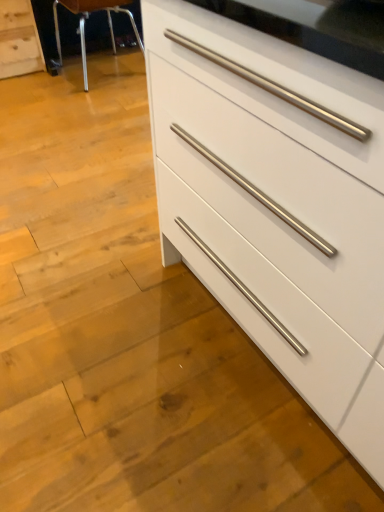
What do you see at coordinates (19, 40) in the screenshot? Image resolution: width=384 pixels, height=512 pixels. I see `white matte chest of drawers at lower left, arranged as the 1th chest of drawers when viewed from the left` at bounding box center [19, 40].

The height and width of the screenshot is (512, 384). What do you see at coordinates (278, 193) in the screenshot? I see `white glossy chest of drawers at center, which is the 2th chest of drawers from top to bottom` at bounding box center [278, 193].

Locate an element on the screen. This screenshot has height=512, width=384. white matte chest of drawers at lower left, which ranks as the second chest of drawers in bottom-to-top order is located at coordinates (19, 40).

Considering the relative sizes of white glossy chest of drawers at center, the first chest of drawers in the right-to-left sequence, and metallic silver bar stool at upper left in the image provided, is white glossy chest of drawers at center, the first chest of drawers in the right-to-left sequence, wider than metallic silver bar stool at upper left?

Yes.

From a real-world perspective, is white glossy chest of drawers at center, which is the 2th chest of drawers from top to bottom, under metallic silver bar stool at upper left?

No, from a real-world perspective, white glossy chest of drawers at center, which is the 2th chest of drawers from top to bottom, is not under metallic silver bar stool at upper left.

How far apart are white glossy chest of drawers at center, the 2th chest of drawers positioned from the left, and metallic silver bar stool at upper left?

A distance of 6.68 feet exists between white glossy chest of drawers at center, the 2th chest of drawers positioned from the left, and metallic silver bar stool at upper left.

Is white glossy chest of drawers at center, the 2th chest of drawers positioned from the left, not inside metallic silver bar stool at upper left?

Yes, white glossy chest of drawers at center, the 2th chest of drawers positioned from the left, is located beyond the bounds of metallic silver bar stool at upper left.

In the scene shown: Considering the relative positions of white glossy chest of drawers at center, which is the 2th chest of drawers from top to bottom, and white matte chest of drawers at lower left, which ranks as the second chest of drawers in bottom-to-top order, in the image provided, is white glossy chest of drawers at center, which is the 2th chest of drawers from top to bottom, to the left of white matte chest of drawers at lower left, which ranks as the second chest of drawers in bottom-to-top order, from the viewer's perspective?

Incorrect, white glossy chest of drawers at center, which is the 2th chest of drawers from top to bottom, is not on the left side of white matte chest of drawers at lower left, which ranks as the second chest of drawers in bottom-to-top order.

Is white glossy chest of drawers at center, which is the 2th chest of drawers from top to bottom, positioned before white matte chest of drawers at lower left, the first chest of drawers from the top?

Yes, white glossy chest of drawers at center, which is the 2th chest of drawers from top to bottom, is closer to the viewer.

Is white glossy chest of drawers at center, which is the 2th chest of drawers from top to bottom, bigger than white matte chest of drawers at lower left, which is the second chest of drawers in right-to-left order?

Indeed, white glossy chest of drawers at center, which is the 2th chest of drawers from top to bottom, has a larger size compared to white matte chest of drawers at lower left, which is the second chest of drawers in right-to-left order.

What's the angular difference between white glossy chest of drawers at center, the first chest of drawers from the bottom, and white matte chest of drawers at lower left, the first chest of drawers from the top,'s facing directions?

90 degrees separate the facing orientations of white glossy chest of drawers at center, the first chest of drawers from the bottom, and white matte chest of drawers at lower left, the first chest of drawers from the top.

From a real-world perspective, which is physically below, metallic silver bar stool at upper left or white matte chest of drawers at lower left, which is the second chest of drawers in right-to-left order?

In real-world perspective, white matte chest of drawers at lower left, which is the second chest of drawers in right-to-left order, is lower.

Who is taller, metallic silver bar stool at upper left or white matte chest of drawers at lower left, which ranks as the second chest of drawers in bottom-to-top order?

Standing taller between the two is metallic silver bar stool at upper left.

Is metallic silver bar stool at upper left thinner than white matte chest of drawers at lower left, the 2th chest of drawers viewed from the front?

In fact, metallic silver bar stool at upper left might be wider than white matte chest of drawers at lower left, the 2th chest of drawers viewed from the front.

Considering the relative positions of metallic silver bar stool at upper left and white matte chest of drawers at lower left, which ranks as the second chest of drawers in bottom-to-top order, in the image provided, is metallic silver bar stool at upper left to the right of white matte chest of drawers at lower left, which ranks as the second chest of drawers in bottom-to-top order, from the viewer's perspective?

Yes.

Which object is positioned more to the left, metallic silver bar stool at upper left or white glossy chest of drawers at center, the first chest of drawers in the right-to-left sequence?

From the viewer's perspective, metallic silver bar stool at upper left appears more on the left side.

From the image's perspective, is metallic silver bar stool at upper left under white glossy chest of drawers at center, the 2th chest of drawers positioned from the left?

No, from the image's perspective, metallic silver bar stool at upper left is not below white glossy chest of drawers at center, the 2th chest of drawers positioned from the left.

Is metallic silver bar stool at upper left far away from white glossy chest of drawers at center, the 1th chest of drawers from the front?

metallic silver bar stool at upper left is positioned a significant distance from white glossy chest of drawers at center, the 1th chest of drawers from the front.

From a real-world perspective, which is physically below, metallic silver bar stool at upper left or white glossy chest of drawers at center, the first chest of drawers in the right-to-left sequence?

metallic silver bar stool at upper left is physically lower.

From the picture: Is white matte chest of drawers at lower left, arranged as the 1th chest of drawers when viewed from the left, smaller than white glossy chest of drawers at center, the 1th chest of drawers from the front?

Correct, white matte chest of drawers at lower left, arranged as the 1th chest of drawers when viewed from the left, occupies less space than white glossy chest of drawers at center, the 1th chest of drawers from the front.

Based on their positions, is white matte chest of drawers at lower left, the 2th chest of drawers viewed from the front, located to the left or right of white glossy chest of drawers at center, the 1th chest of drawers from the front?

Clearly, white matte chest of drawers at lower left, the 2th chest of drawers viewed from the front, is on the left of white glossy chest of drawers at center, the 1th chest of drawers from the front, in the image.

Is white matte chest of drawers at lower left, the 2th chest of drawers viewed from the front, not near white glossy chest of drawers at center, the first chest of drawers from the bottom?

white matte chest of drawers at lower left, the 2th chest of drawers viewed from the front, is far away from white glossy chest of drawers at center, the first chest of drawers from the bottom.

Does point (4, 28) come closer to viewer compared to point (242, 209)?

No, it is behind (242, 209).

Measure the distance between white matte chest of drawers at lower left, the first chest of drawers from the top, and metallic silver bar stool at upper left.

white matte chest of drawers at lower left, the first chest of drawers from the top, and metallic silver bar stool at upper left are 10.74 inches apart.

Is white matte chest of drawers at lower left, which is the second chest of drawers in right-to-left order, directly adjacent to metallic silver bar stool at upper left?

No, white matte chest of drawers at lower left, which is the second chest of drawers in right-to-left order, is not making contact with metallic silver bar stool at upper left.

Which of these two, white matte chest of drawers at lower left, which is the second chest of drawers in right-to-left order, or metallic silver bar stool at upper left, is thinner?

white matte chest of drawers at lower left, which is the second chest of drawers in right-to-left order.

Is metallic silver bar stool at upper left at the back of white matte chest of drawers at lower left, the 2th chest of drawers viewed from the front?

No, white matte chest of drawers at lower left, the 2th chest of drawers viewed from the front,'s orientation is not away from metallic silver bar stool at upper left.

Locate an element on the screen. The width and height of the screenshot is (384, 512). the chest of drawers in front of the metallic silver bar stool at upper left is located at coordinates (278, 193).

Where is `the chest of drawers below the white matte chest of drawers at lower left, which ranks as the second chest of drawers in bottom-to-top order (from the image's perspective)`? This screenshot has width=384, height=512. the chest of drawers below the white matte chest of drawers at lower left, which ranks as the second chest of drawers in bottom-to-top order (from the image's perspective) is located at coordinates (278, 193).

Looking at the image, which one is located further to metallic silver bar stool at upper left, white matte chest of drawers at lower left, which is the second chest of drawers in right-to-left order, or white glossy chest of drawers at center, the 2th chest of drawers positioned from the left?

white glossy chest of drawers at center, the 2th chest of drawers positioned from the left, is positioned further to the anchor metallic silver bar stool at upper left.

Looking at this image, from the image, which object appears to be farther from white glossy chest of drawers at center, which is the 2th chest of drawers from top to bottom, metallic silver bar stool at upper left or white matte chest of drawers at lower left, the 2th chest of drawers viewed from the front?

Based on the image, white matte chest of drawers at lower left, the 2th chest of drawers viewed from the front, appears to be further to white glossy chest of drawers at center, which is the 2th chest of drawers from top to bottom.

When comparing their distances from white glossy chest of drawers at center, the first chest of drawers in the right-to-left sequence, does white matte chest of drawers at lower left, which is the second chest of drawers in right-to-left order, or metallic silver bar stool at upper left seem closer?

metallic silver bar stool at upper left lies closer to white glossy chest of drawers at center, the first chest of drawers in the right-to-left sequence, than the other object.

Estimate the real-world distances between objects in this image. Which object is further from metallic silver bar stool at upper left, white glossy chest of drawers at center, which is the 2th chest of drawers from top to bottom, or white matte chest of drawers at lower left, the first chest of drawers from the top?

white glossy chest of drawers at center, which is the 2th chest of drawers from top to bottom, is further to metallic silver bar stool at upper left.

Estimate the real-world distances between objects in this image. Which object is further from white matte chest of drawers at lower left, the first chest of drawers from the top, metallic silver bar stool at upper left or white glossy chest of drawers at center, the first chest of drawers in the right-to-left sequence?

white glossy chest of drawers at center, the first chest of drawers in the right-to-left sequence, is positioned further to the anchor white matte chest of drawers at lower left, the first chest of drawers from the top.

Based on their spatial positions, is white glossy chest of drawers at center, the 1th chest of drawers from the front, or metallic silver bar stool at upper left closer to white matte chest of drawers at lower left, the first chest of drawers from the top?

Among the two, metallic silver bar stool at upper left is located nearer to white matte chest of drawers at lower left, the first chest of drawers from the top.

Find the location of a particular element. bar stool between white glossy chest of drawers at center, the first chest of drawers in the right-to-left sequence, and white matte chest of drawers at lower left, the first chest of drawers from the top, along the z-axis is located at coordinates (84, 25).